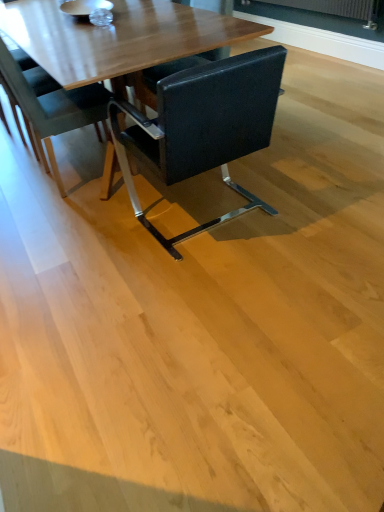
Locate an element on the screen. The image size is (384, 512). vacant space situated on the left part of black leather chair at center, the second chair in the left-to-right sequence is located at coordinates pyautogui.click(x=84, y=242).